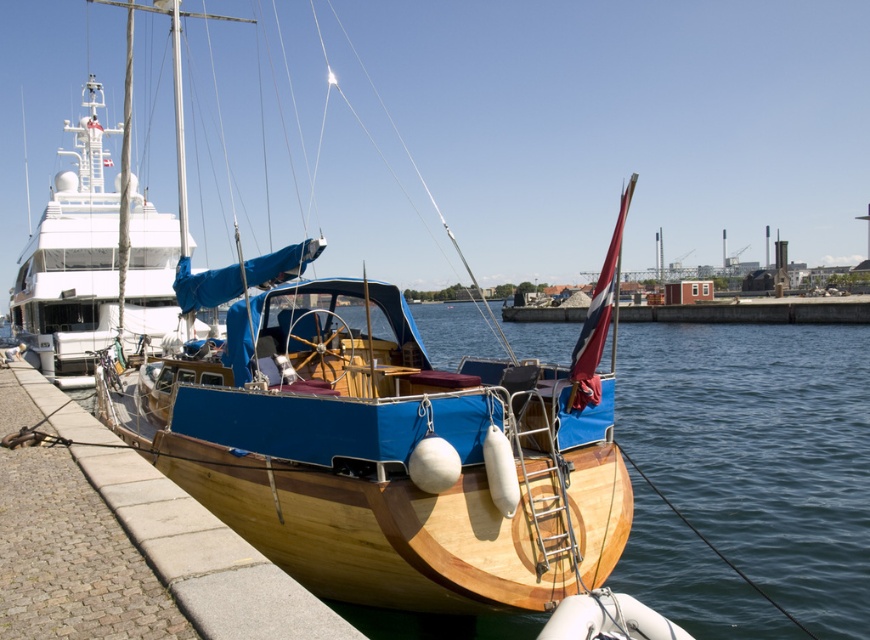
Question: Does white glossy yacht at upper left lie in front of brown wooden dock at lower left?

Choices:
 (A) yes
 (B) no

Answer: (B)

Question: Does wooden sailboat at center have a lesser width compared to brown wooden dock at lower left?

Choices:
 (A) no
 (B) yes

Answer: (A)

Question: Which of the following is the farthest from the observer?

Choices:
 (A) brown wooden dock at lower left
 (B) wooden sailboat at center

Answer: (B)

Question: Which object is closer to the camera taking this photo?

Choices:
 (A) brown wooden dock at lower left
 (B) white glossy yacht at upper left

Answer: (A)

Question: Can you confirm if wooden sailboat at center is positioned above white glossy yacht at upper left?

Choices:
 (A) no
 (B) yes

Answer: (A)

Question: Which is farther from the white glossy yacht at upper left?

Choices:
 (A) brown wooden dock at lower left
 (B) wooden sailboat at center

Answer: (A)